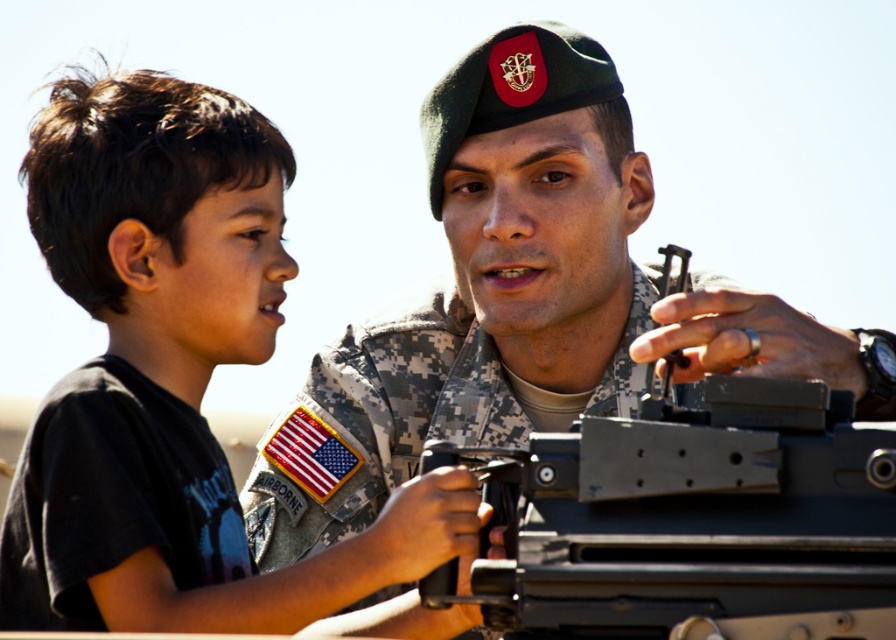
Question: Does black matte shirt at left come behind camouflage uniform at center?

Choices:
 (A) yes
 (B) no

Answer: (B)

Question: Estimate the real-world distances between objects in this image. Which object is farther from the black matte shirt at left?

Choices:
 (A) black matte t-shirt at left
 (B) camouflage uniform at center

Answer: (B)

Question: Based on their relative distances, which object is nearer to the black matte shirt at left?

Choices:
 (A) black matte t-shirt at left
 (B) camouflage uniform at center

Answer: (A)

Question: Is black matte shirt at left further to the viewer compared to black matte t-shirt at left?

Choices:
 (A) yes
 (B) no

Answer: (A)

Question: Is black matte shirt at left to the left of camouflage uniform at center from the viewer's perspective?

Choices:
 (A) no
 (B) yes

Answer: (B)

Question: Which object appears farthest from the camera in this image?

Choices:
 (A) camouflage uniform at center
 (B) black matte t-shirt at left
 (C) black matte shirt at left

Answer: (A)